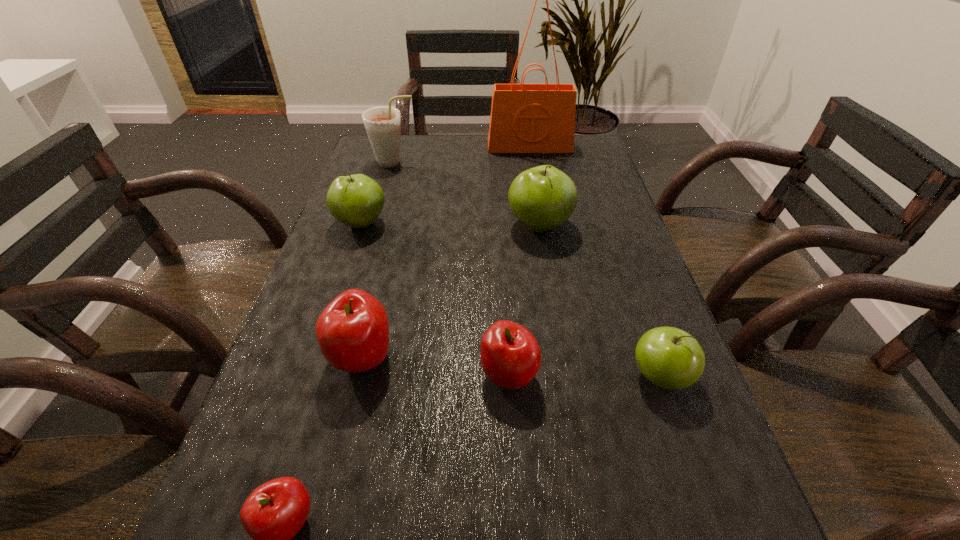
What are the coordinates of `vacant space positioned 0.250m on the logo side of the farthest object` in the screenshot? It's located at (539, 198).

Where is `vacant region located on the drink side of the root beer`? Image resolution: width=960 pixels, height=540 pixels. vacant region located on the drink side of the root beer is located at coordinates tap(491, 163).

At what (x,y) coordinates should I click in order to perform the action: click on vacant area situated on the right of the biggest green apple. Please return your answer as a coordinate pair (x, y). This screenshot has width=960, height=540. Looking at the image, I should click on (612, 226).

The width and height of the screenshot is (960, 540). Identify the location of vacant point located on the back of the second smallest green apple. (375, 181).

This screenshot has width=960, height=540. Identify the location of free space located 0.070m on the left of the biggest red apple. (292, 357).

At what (x,y) coordinates should I click in order to perform the action: click on vacant space located on the back of the rightmost green apple. Please return your answer as a coordinate pair (x, y). This screenshot has height=540, width=960. Looking at the image, I should click on (616, 253).

At what (x,y) coordinates should I click in order to perform the action: click on vacant space located 0.130m on the right of the second smallest red apple. Please return your answer as a coordinate pair (x, y). The width and height of the screenshot is (960, 540). Looking at the image, I should click on (612, 376).

Where is `tote bag at the far edge`? This screenshot has width=960, height=540. tote bag at the far edge is located at coordinates (525, 118).

Where is `root beer situated at the far edge`? The height and width of the screenshot is (540, 960). root beer situated at the far edge is located at coordinates (382, 124).

I want to click on root beer that is at the left edge, so click(x=382, y=124).